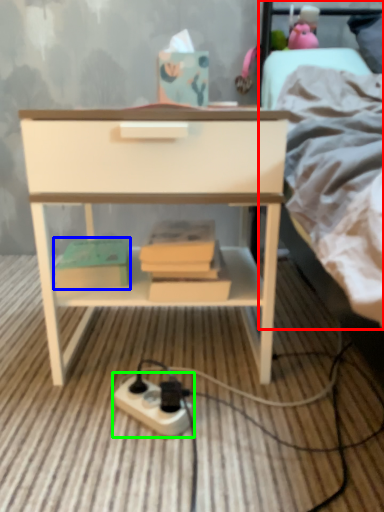
Question: Based on their relative distances, which object is nearer to bed (highlighted by a red box)? Choose from paperback book (highlighted by a blue box) and power plugs and sockets (highlighted by a green box).

Choices:
 (A) paperback book
 (B) power plugs and sockets

Answer: (A)